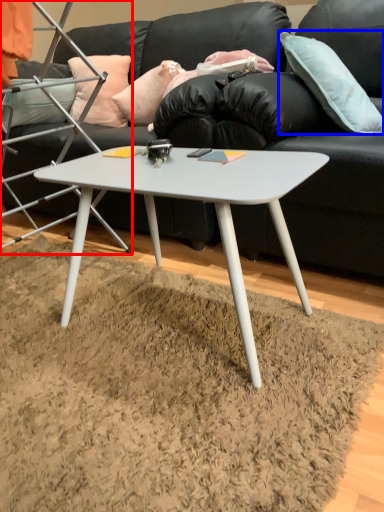
Question: Which point is closer to the camera, chair (highlighted by a red box) or pillow (highlighted by a blue box)?

Choices:
 (A) chair
 (B) pillow

Answer: (A)